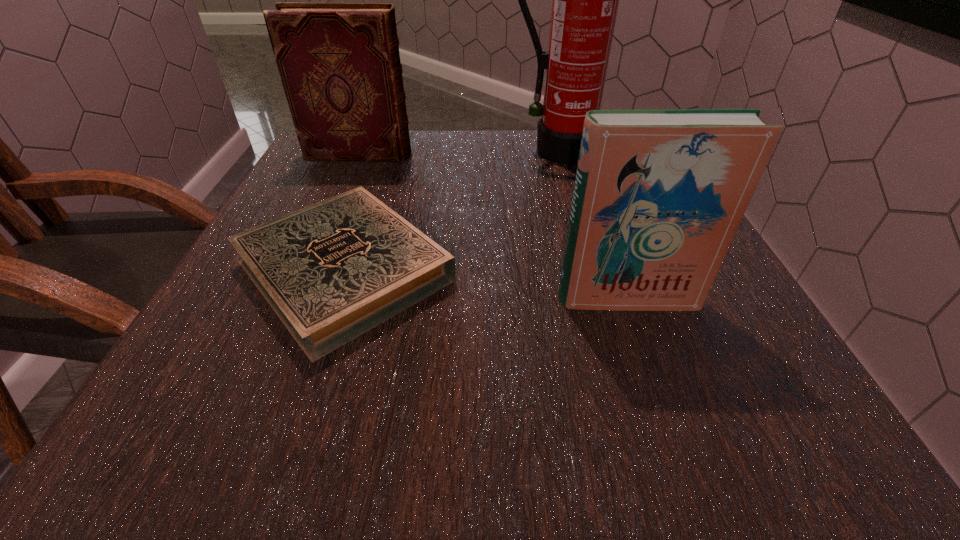
This screenshot has width=960, height=540. Find the location of `empty space that is in between the farthest hardback book and the rightmost hardback book`. empty space that is in between the farthest hardback book and the rightmost hardback book is located at coordinates (493, 227).

What are the coordinates of `free spot between the farthest hardback book and the fire extinguisher` in the screenshot? It's located at (457, 153).

Identify the location of vacant space that is in between the farthest hardback book and the fire extinguisher. (457, 153).

The height and width of the screenshot is (540, 960). Find the location of `unoccupied area between the farthest hardback book and the tallest object`. unoccupied area between the farthest hardback book and the tallest object is located at coordinates (457, 153).

The height and width of the screenshot is (540, 960). I want to click on vacant area that lies between the rightmost hardback book and the farthest hardback book, so click(493, 227).

This screenshot has width=960, height=540. I want to click on free space between the farthest hardback book and the tallest object, so click(x=457, y=153).

You are a GUI agent. You are given a task and a screenshot of the screen. Output one action in this format:
    pyautogui.click(x=<x>, y=<y>)
    Task: Click on the free space between the tallest object and the shortest object
    This screenshot has width=960, height=540.
    Given the screenshot: What is the action you would take?
    pyautogui.click(x=449, y=211)

Select which object is the third closest to the farthest hardback book. Please provide its 2D coordinates. Your answer should be formatted as a tuple, i.e. [(x, y)], where the tuple contains the x and y coordinates of a point satisfying the conditions above.

[(659, 194)]

Locate an element on the screen. The image size is (960, 540). object that is the second nearest to the fire extinguisher is located at coordinates (339, 63).

Choose which hardback book is the nearest neighbor to the shortest object. Please provide its 2D coordinates. Your answer should be formatted as a tuple, i.e. [(x, y)], where the tuple contains the x and y coordinates of a point satisfying the conditions above.

[(659, 194)]